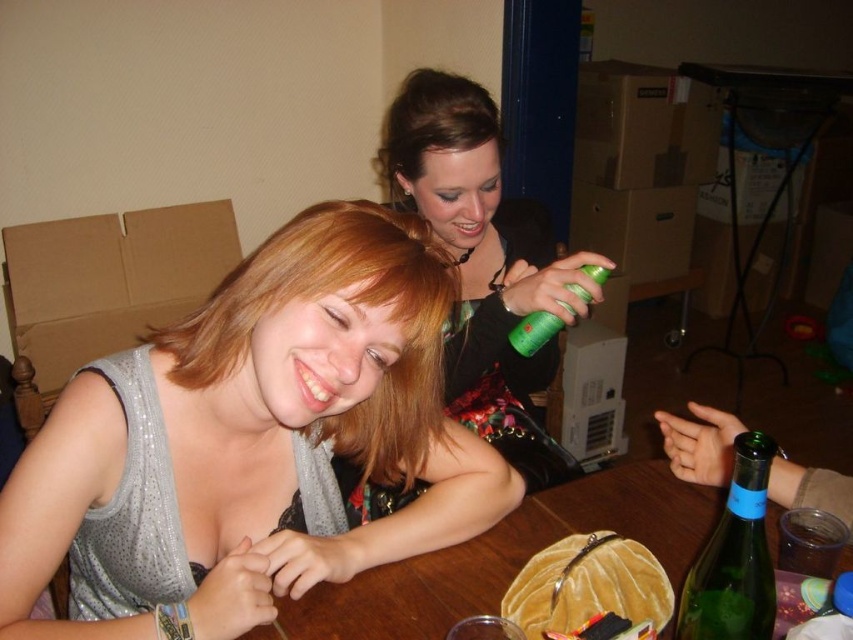
In the scene shown: Is the position of shiny silver tank top at center less distant than that of green glass bottle at lower right?

That is False.

Between shiny silver tank top at center and green glass bottle at lower right, which one has less height?

green glass bottle at lower right

At what (x,y) coordinates should I click in order to perform the action: click on shiny silver tank top at center. Please return your answer as a coordinate pair (x, y). Looking at the image, I should click on (265, 433).

Is green glass bottle at lower right further to camera compared to green matte spray can at upper center?

No, green glass bottle at lower right is in front of green matte spray can at upper center.

Does green glass bottle at lower right appear on the left side of green matte spray can at upper center?

No, green glass bottle at lower right is not to the left of green matte spray can at upper center.

What do you see at coordinates (734, 556) in the screenshot?
I see `green glass bottle at lower right` at bounding box center [734, 556].

Identify the location of green glass bottle at lower right. (734, 556).

Is velvet brown purse at center shorter than green glass bottle at lower right?

Correct, velvet brown purse at center is not as tall as green glass bottle at lower right.

Between velvet brown purse at center and green glass bottle at lower right, which one has less height?

With less height is velvet brown purse at center.

In order to click on velvet brown purse at center in this screenshot , I will do `click(506, 556)`.